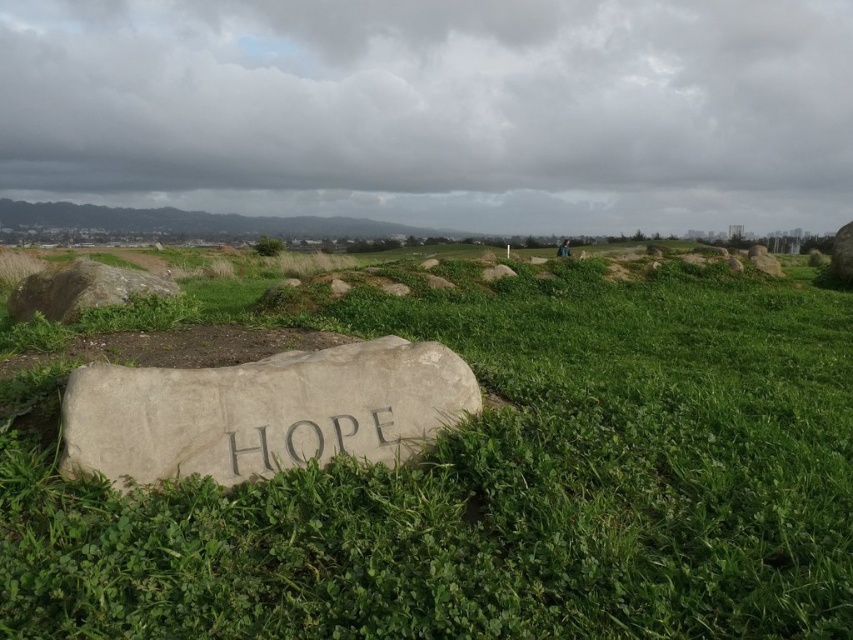
You are standing in the outdoor scene and want to place a small flag between the green grassy at center and the gray stone at upper left. Based on their positions, which object should the flag be closer to?

The green grassy at center is in front of the gray stone at upper left, so the flag should be placed closer to the gray stone at upper left to ensure it is visible between them.

You are standing at the origin point in this serene outdoor scene. The green grassy area at center is located at coordinates point 0.762, 0.592. If you want to walk directly to the green grassy at center, which direction should you head towards?

You should head towards the coordinates point (503, 486), which is the location of the green grassy at center.

In the scene shown: You are planning to place a small garden ornament that requires a base wider than 10 cm. Looking at the image, which of the gray stone at center or gray stone at upper left would be more suitable as a base?

The gray stone at upper left is thicker and wider than the gray stone at center, making it more suitable as a base for the garden ornament requiring a base wider than 10 cm.